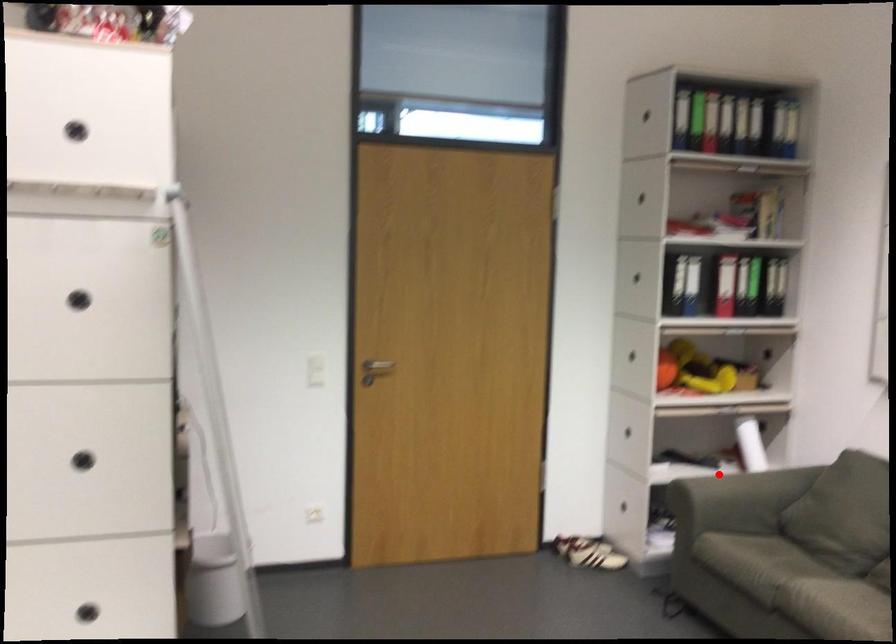
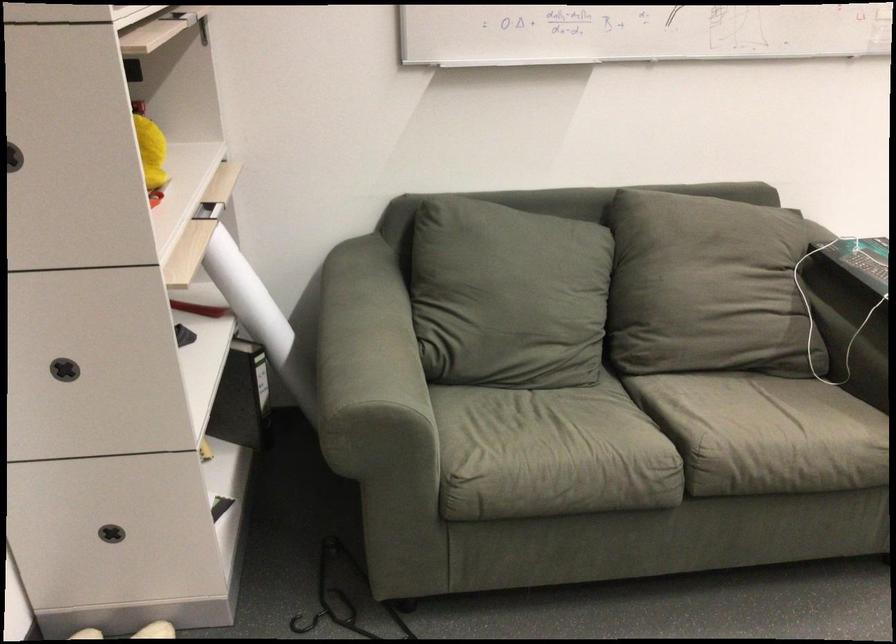
Question: A red point is marked in image1. In image2, is the corresponding 3D point closer to the camera or farther? Reply with the corresponding letter.

Choices:
 (A) The corresponding 3D point is closer.
 (B) The corresponding 3D point is farther.

Answer: (A)